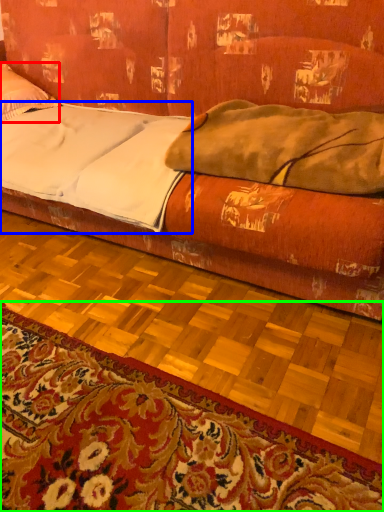
Question: Which is farther away from pillow (highlighted by a red box)? sheet (highlighted by a blue box) or mat (highlighted by a green box)?

Choices:
 (A) sheet
 (B) mat

Answer: (B)